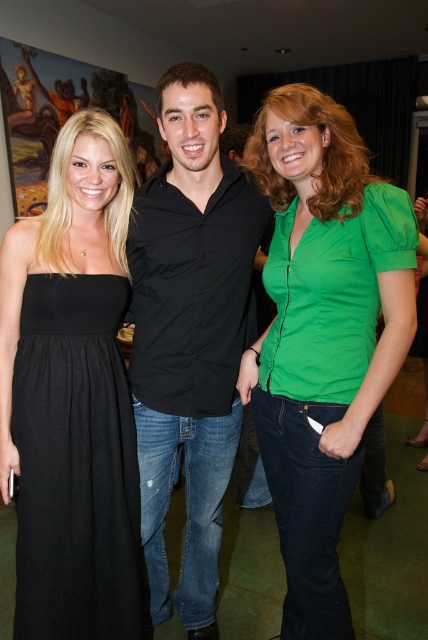
You are organizing a charity event and need to ensure that all participants can move comfortably between the green matte shirt at center and the black smooth shirt at center. Based on the space they occupy, which shirt is taking up more space and might require more clearance?

The black smooth shirt at center occupies more space than the green matte shirt at center, so it requires more clearance.